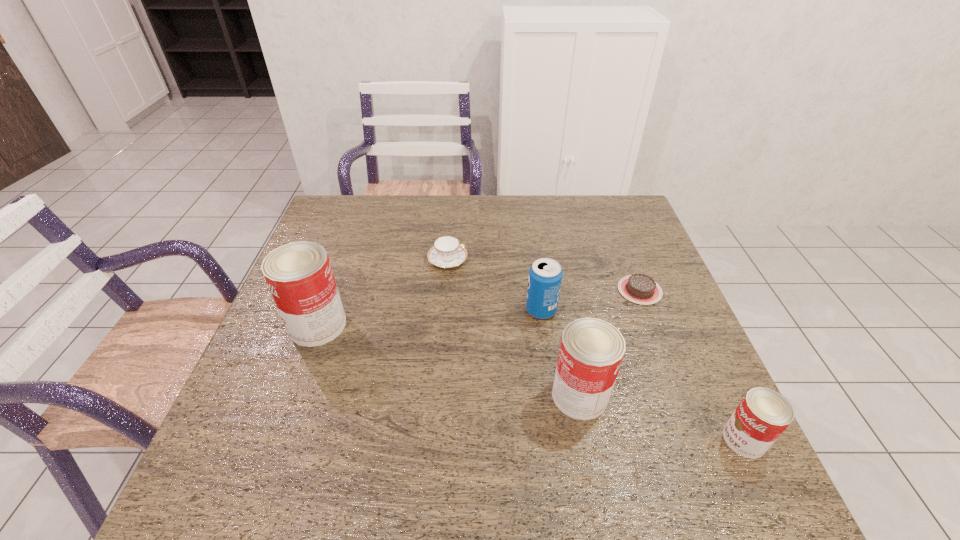
Find the location of a particular element. The height and width of the screenshot is (540, 960). object present at the near right corner is located at coordinates (762, 416).

You are a GUI agent. You are given a task and a screenshot of the screen. Output one action in this format:
    pyautogui.click(x=<x>, y=<y>)
    Task: Click on the vacant space at the far edge of the desktop
    This screenshot has width=960, height=540.
    Given the screenshot: What is the action you would take?
    pyautogui.click(x=427, y=235)

You are a GUI agent. You are given a task and a screenshot of the screen. Output one action in this format:
    pyautogui.click(x=<x>, y=<y>)
    Task: Click on the free space at the near edge of the desktop
    Image resolution: width=960 pixels, height=540 pixels.
    Given the screenshot: What is the action you would take?
    pyautogui.click(x=536, y=423)

Locate an element on the screen. free space at the left edge of the desktop is located at coordinates (343, 244).

At what (x,y) coordinates should I click in order to perform the action: click on free region at the right edge of the desktop. Please return your answer as a coordinate pair (x, y). The width and height of the screenshot is (960, 540). Looking at the image, I should click on (644, 350).

Identify the location of vacant region at the far left corner of the desktop. (333, 202).

Find the location of a particular element. free space at the near right corner of the desktop is located at coordinates (708, 433).

Find the location of `empty space that is in between the leftmost can and the soda can`. empty space that is in between the leftmost can and the soda can is located at coordinates pos(429,318).

I want to click on vacant region between the shortest can and the fourth shortest object, so click(643, 375).

You are a GUI agent. You are given a task and a screenshot of the screen. Output one action in this format:
    pyautogui.click(x=<x>, y=<y>)
    Task: Click on the vacant area that lies between the second shortest object and the leftmost object
    This screenshot has width=960, height=540.
    Given the screenshot: What is the action you would take?
    pyautogui.click(x=383, y=293)